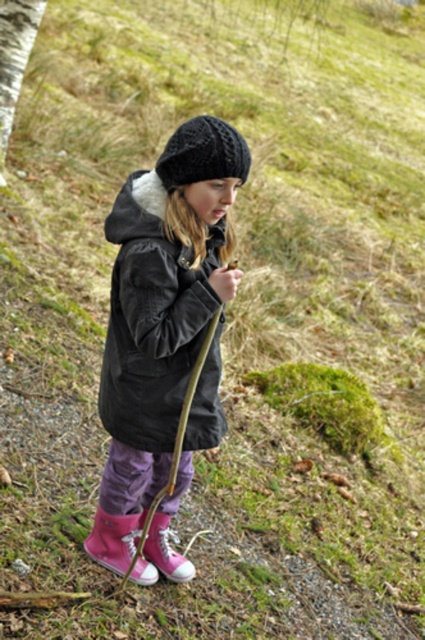
The young girl is standing in a natural setting with two pink suede boots visible. Which boot has a greater width, the pink suede boot at lower left or the pink suede boot at lower center?

The pink suede boot at lower left has a greater width than the pink suede boot at lower center.

The girl is holding a stick and wearing a black knitted hat at upper center and a pink suede boot at lower center. Which of these items is positioned higher on her body?

The black knitted hat at upper center is positioned higher on her body than the pink suede boot at lower center.